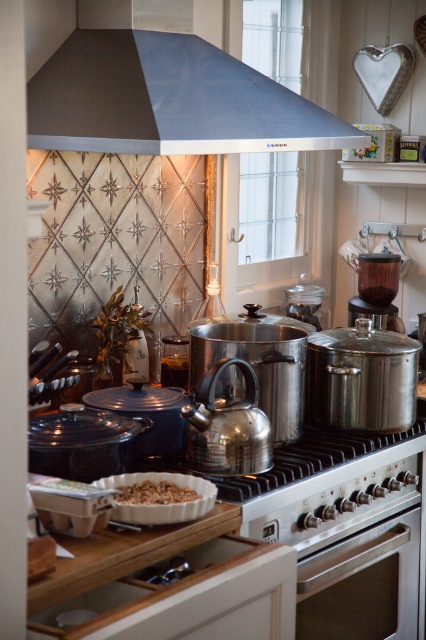
Question: Which of these objects is positioned closest to the brown crumbly at center?

Choices:
 (A) stainless steel oven at lower center
 (B) satin steel exhaust hood at upper center

Answer: (A)

Question: Is satin steel exhaust hood at upper center behind brown crumbly at center?

Choices:
 (A) yes
 (B) no

Answer: (A)

Question: Does stainless steel oven at lower center appear over brown crumbly at center?

Choices:
 (A) yes
 (B) no

Answer: (B)

Question: Can you confirm if satin steel exhaust hood at upper center is positioned above stainless steel oven at lower center?

Choices:
 (A) no
 (B) yes

Answer: (B)

Question: Among these points, which one is nearest to the camera?

Choices:
 (A) (360, 612)
 (B) (89, 141)
 (C) (138, 497)

Answer: (C)

Question: Which object is closer to the camera taking this photo?

Choices:
 (A) brown crumbly at center
 (B) stainless steel oven at lower center

Answer: (A)